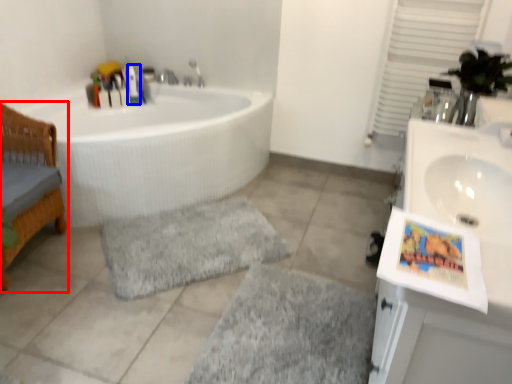
Question: Which point is further to the camera, furniture (highlighted by a red box) or toiletry (highlighted by a blue box)?

Choices:
 (A) furniture
 (B) toiletry

Answer: (B)